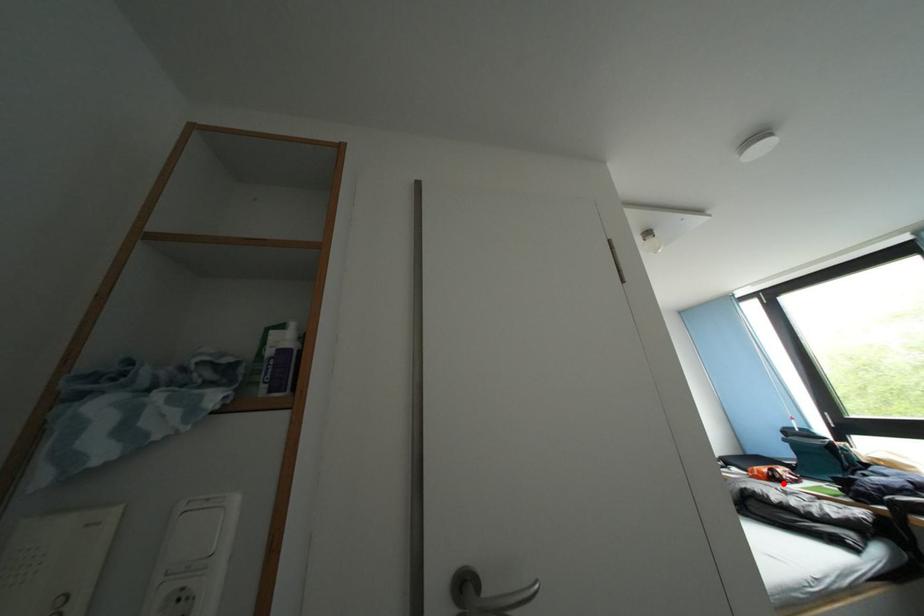
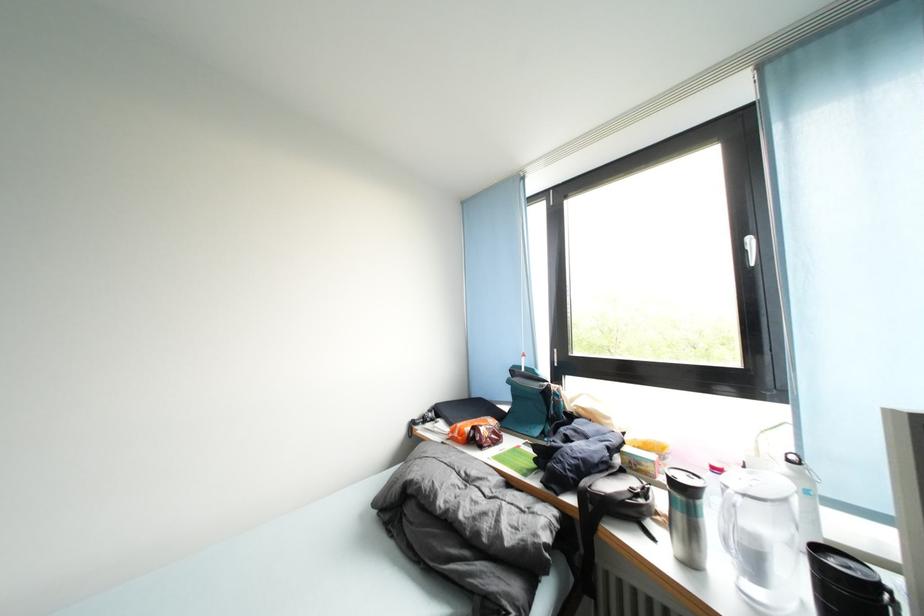
Question: A red point is marked in image1. In image2, is the corresponding 3D point closer to the camera or farther? Reply with the corresponding letter.

Choices:
 (A) The corresponding 3D point is closer.
 (B) The corresponding 3D point is farther.

Answer: (B)